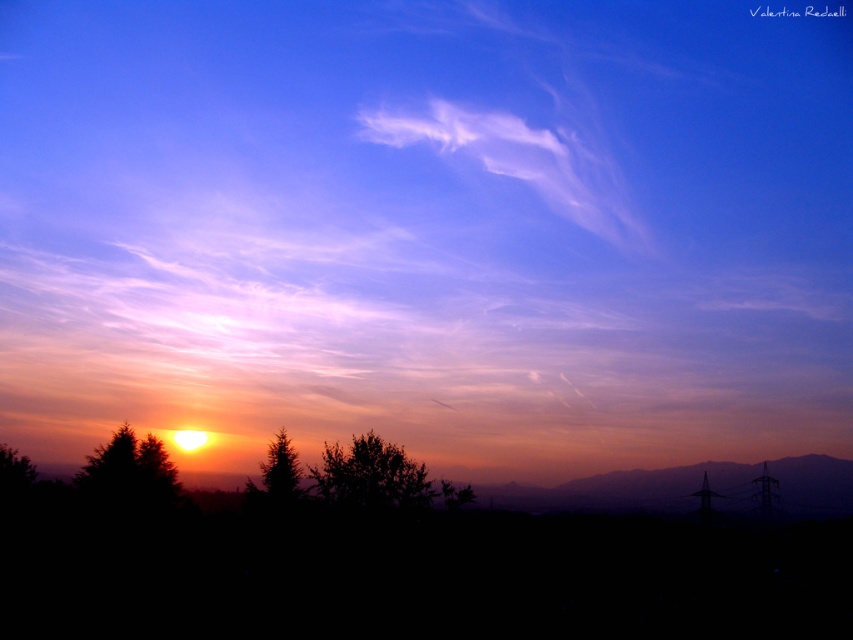
You are an artist painting the sunset scene described. You want to ensure the green leafy tree at center and the green matte tree at center are proportionally accurate. Which tree should you paint larger?

The green leafy tree at center should be painted larger than the green matte tree at center since it has a larger size compared to it according to the description.

You are standing at the base of a 150 meter tall building. You see a point at coordinates point (827, 460) in the scene. Can you safely look at this point without exceeding the building height?

The point at point (827, 460) is 176.61 meters from the viewer. Since the building is 150 meters tall, the point is higher than the building, so you can safely look at it without exceeding the building height.